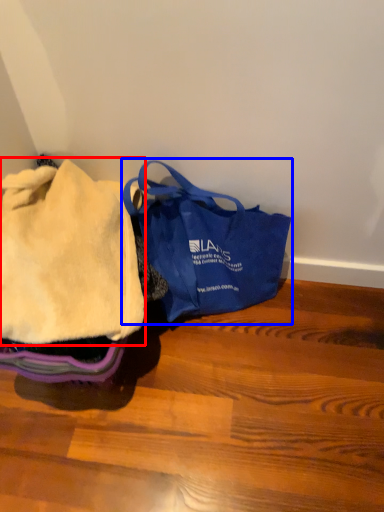
Question: Which object is further to the camera taking this photo, cloth (highlighted by a red box) or handbag (highlighted by a blue box)?

Choices:
 (A) cloth
 (B) handbag

Answer: (B)